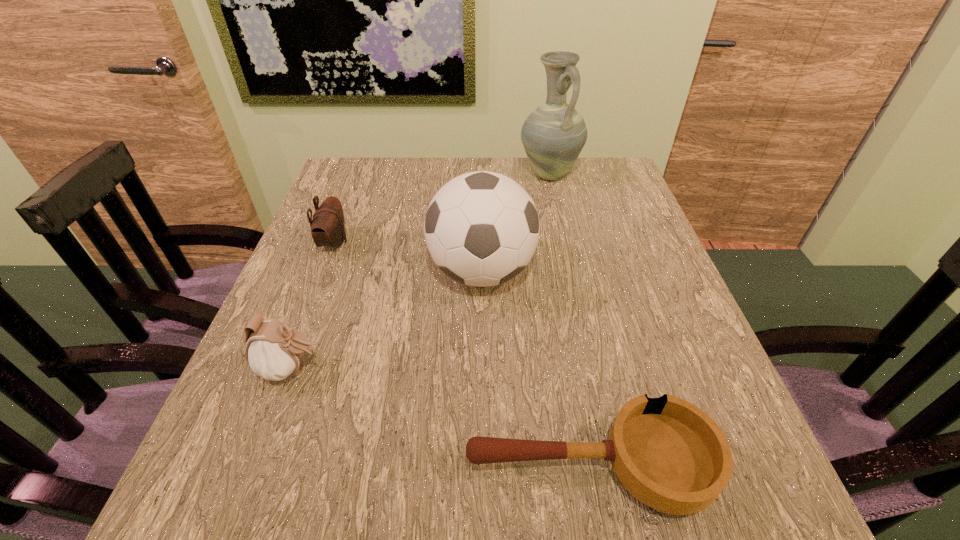
Locate an element on the screen. The width and height of the screenshot is (960, 540). free space between the saucepan and the second nearest object is located at coordinates (440, 417).

In order to click on free space between the soccer ball and the nearest object in this screenshot , I will do `click(535, 369)`.

At what (x,y) coordinates should I click in order to perform the action: click on empty space between the farthest object and the saucepan. Please return your answer as a coordinate pair (x, y). The width and height of the screenshot is (960, 540). Looking at the image, I should click on (568, 320).

Where is `free space between the pitcher and the saucepan`? free space between the pitcher and the saucepan is located at coordinates (568, 320).

This screenshot has height=540, width=960. In order to click on object that is the third closest to the pitcher in this screenshot , I will do `click(274, 350)`.

Identify which object is the second nearest to the saucepan. Please provide its 2D coordinates. Your answer should be formatted as a tuple, i.e. [(x, y)], where the tuple contains the x and y coordinates of a point satisfying the conditions above.

[(274, 350)]

Where is `free space that satisfies the following two spatial constraints: 1. with the flap open on the farther pouch; 2. on the right side of the second tallest object`? free space that satisfies the following two spatial constraints: 1. with the flap open on the farther pouch; 2. on the right side of the second tallest object is located at coordinates (323, 272).

This screenshot has width=960, height=540. Identify the location of free region that satisfies the following two spatial constraints: 1. on the handle side of the farthest object; 2. on the front-facing side of the nearer pouch. (593, 369).

You are a GUI agent. You are given a task and a screenshot of the screen. Output one action in this format:
    pyautogui.click(x=<x>, y=<y>)
    Task: Click on the vacant area that satisfies the following two spatial constraints: 1. on the front-facing side of the nearer pouch; 2. with the handle on the side of the saucepan
    
    Given the screenshot: What is the action you would take?
    pyautogui.click(x=254, y=467)

What are the coordinates of `vacant space that satisfies the following two spatial constraints: 1. with the flap open on the farther pouch; 2. with the handle on the side of the saucepan` in the screenshot? It's located at (248, 467).